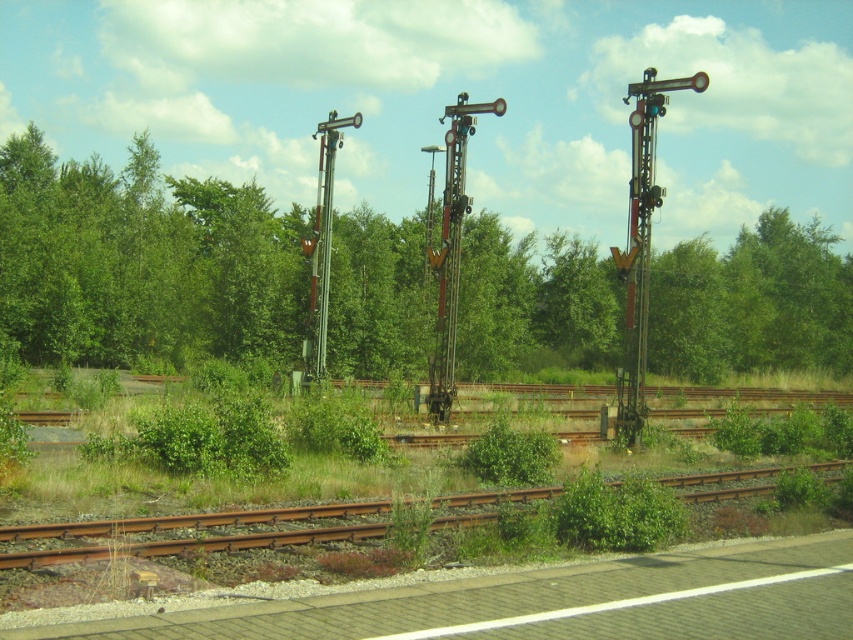
Does point (566, 234) lie in front of point (445, 140)?

No, it is not.

Is green leafy trees at center to the left of metallic gray pole at center from the viewer's perspective?

Indeed, green leafy trees at center is positioned on the left side of metallic gray pole at center.

Does point (1, 180) come closer to viewer compared to point (436, 355)?

No.

In order to click on green leafy trees at center in this screenshot , I will do `click(142, 262)`.

Who is shorter, rusty metal train track at lower center or metallic gray pole at center?

With less height is rusty metal train track at lower center.

Can you confirm if rusty metal train track at lower center is smaller than metallic gray pole at center?

Yes, rusty metal train track at lower center is smaller than metallic gray pole at center.

What do you see at coordinates (189, 520) in the screenshot?
I see `rusty metal train track at lower center` at bounding box center [189, 520].

Identify the location of rusty metal train track at lower center. This screenshot has height=640, width=853. (189, 520).

Does point (375, 212) come behind point (480, 518)?

Yes, point (375, 212) is farther from viewer.

Between green leafy trees at center and rusty metal train track at lower center, which one has more height?

Standing taller between the two is green leafy trees at center.

The height and width of the screenshot is (640, 853). Identify the location of green leafy trees at center. (142, 262).